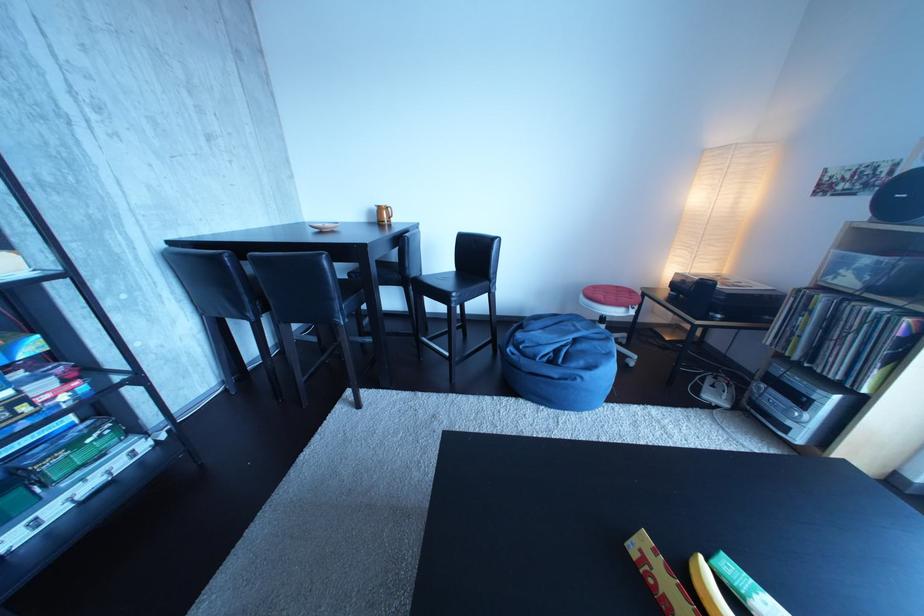
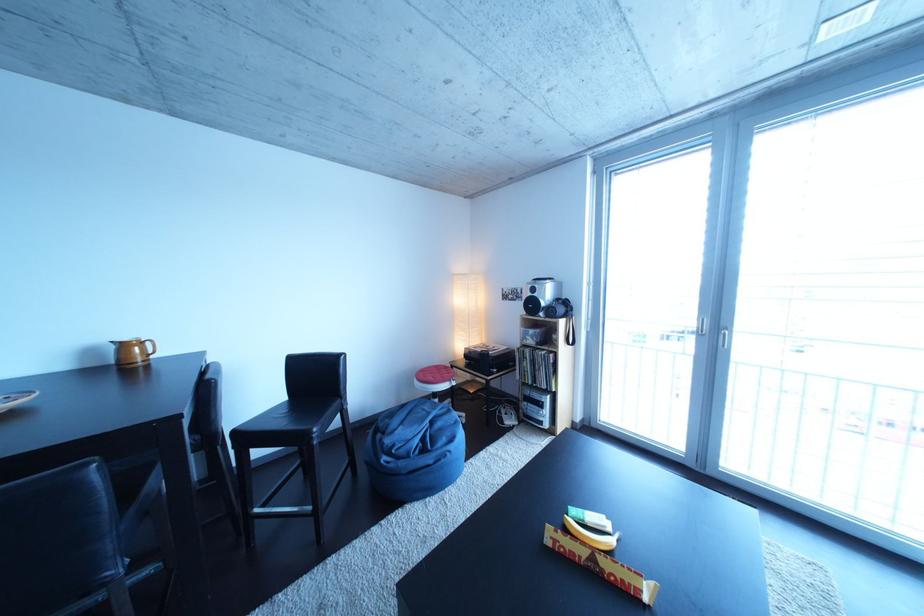
Where in the second image is the point corresponding to the point at 784,405 from the first image?

(543, 415)